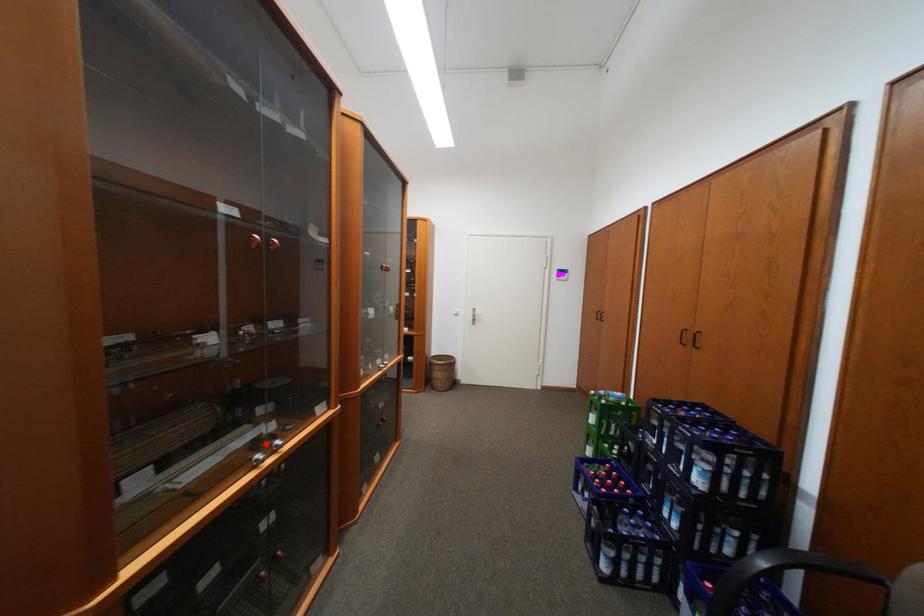
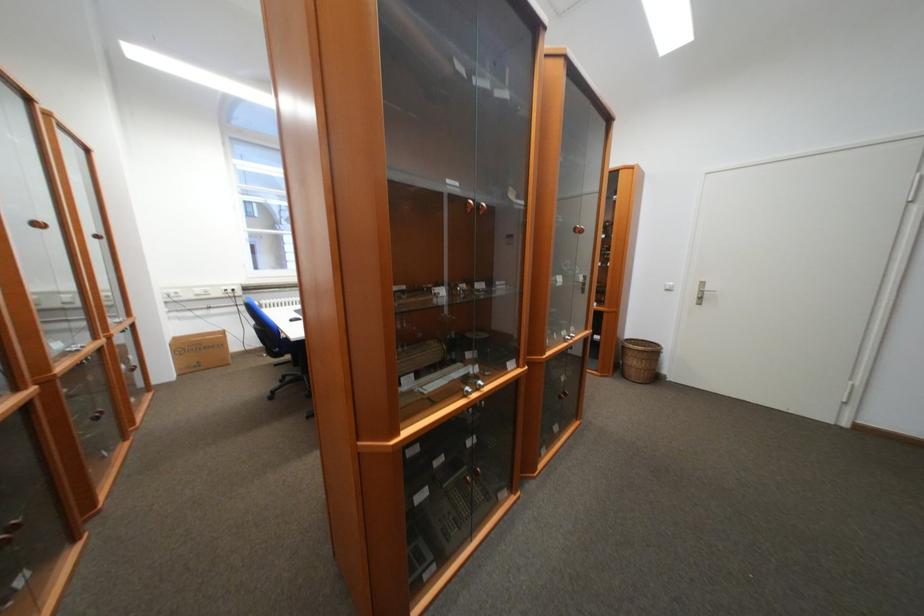
Where in the second image is the point corresponding to the highlighted location from the first image?

(476, 379)